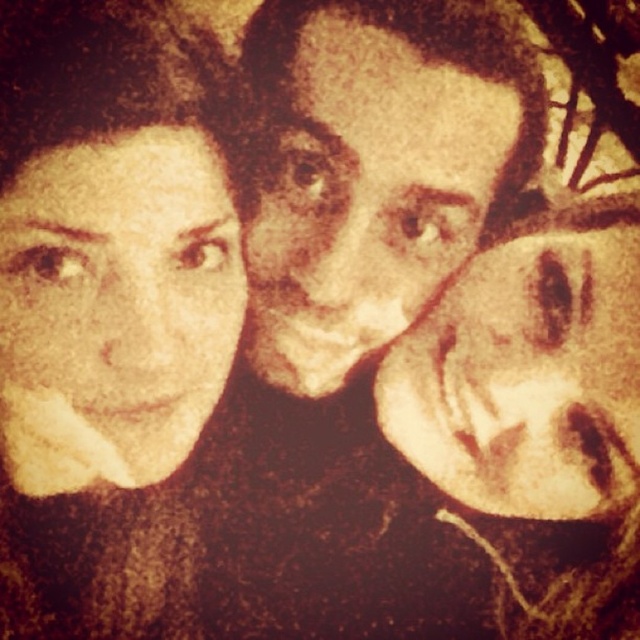
You are an artist trying to replicate this vintage portrait. You notice two faces in the image. The brown matte face at center and the smooth beige face at right. Which face should you paint larger to stay true to the original?

The brown matte face at center should be painted larger than the smooth beige face at right to stay true to the original.

You are an artist trying to replicate this vintage portrait. You have two faces to paint, the matte yellow face at left and the smooth beige face at right. Based on the image, which face should you paint larger to maintain the original composition?

The matte yellow face at left should be painted larger than the smooth beige face at right to maintain the original composition.

You are an art restorer examining a vintage photograph. You notice a matte yellow face at left in the image. Based on the coordinates provided in the Objects Description, can you determine if this face is positioned near the center of the image?

The matte yellow face at left is located at point [115,308]. Since the coordinates are given as fractions of the image dimensions, the x coordinate 0.483 is very close to the center horizontally, but the y coordinate 0.180 places it closer to the top of the image rather than the bottom. Therefore, it is near the center horizontally but higher up vertically, so not exactly at the overall center of the image.